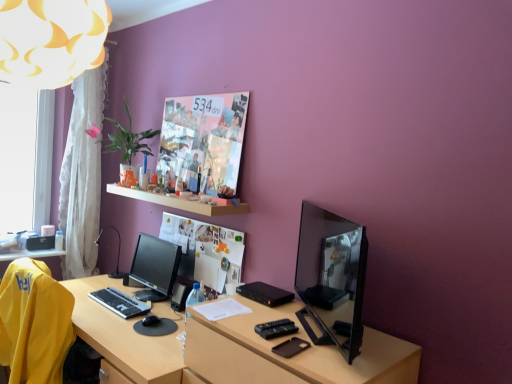
Question: Considering the positions of point (64, 180) and point (345, 342), is point (64, 180) closer or farther from the camera than point (345, 342)?

Choices:
 (A) closer
 (B) farther

Answer: (B)

Question: Considering the positions of white sheer curtain at left and shiny black monitor at right, the 2th computer monitor positioned from the left, in the image, is white sheer curtain at left bigger or smaller than shiny black monitor at right, the 2th computer monitor positioned from the left,?

Choices:
 (A) small
 (B) big

Answer: (B)

Question: Considering the real-world distances, which object is farthest from the satin black monitor at center, the second computer monitor positioned from the right?

Choices:
 (A) matte black tv at right
 (B) transparent glass window at left
 (C) wooden desk at center
 (D) white wooden shelf at upper center
 (E) black plastic keyboard at lower left

Answer: (B)

Question: Which object is positioned closest to the transparent glass window at left?

Choices:
 (A) black plastic table lamp at left
 (B) satin black monitor at center, the second computer monitor positioned from the right
 (C) white wooden shelf at upper center
 (D) white fabric lampshade at upper left
 (E) white sheer curtain at left

Answer: (E)